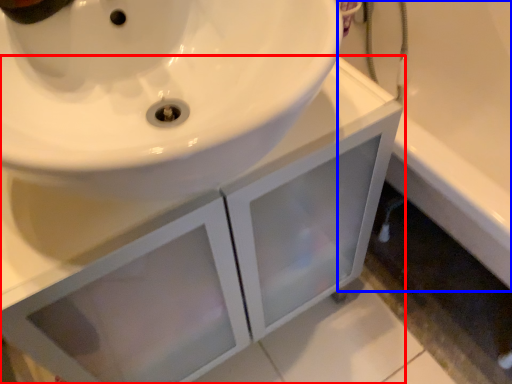
Question: Among these objects, which one is farthest to the camera, bathroom cabinet (highlighted by a red box) or bath (highlighted by a blue box)?

Choices:
 (A) bathroom cabinet
 (B) bath

Answer: (B)